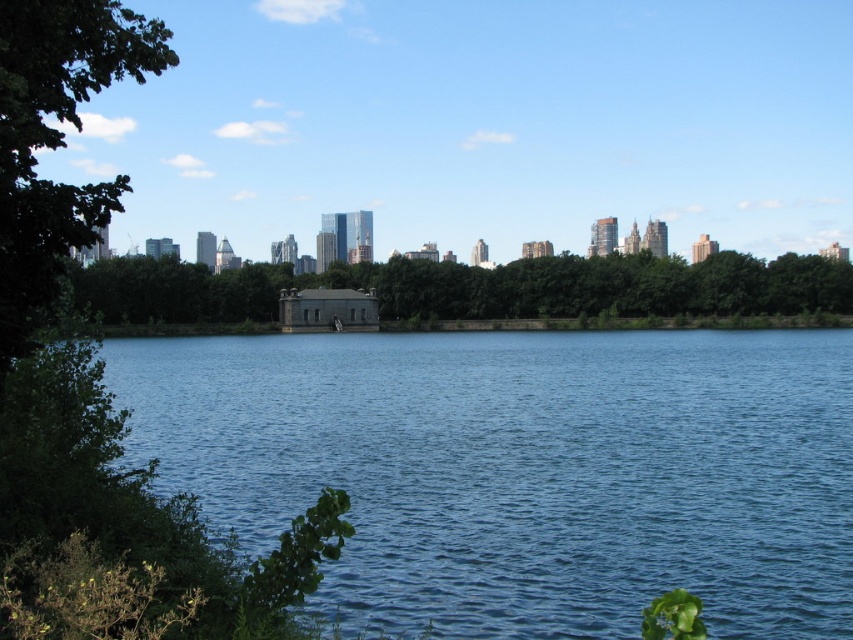
Between point (689, 586) and point (167, 61), which one is positioned in front?

Point (689, 586) is more forward.

Does blue water at center have a greater height compared to green leafy tree at left?

No.

Image resolution: width=853 pixels, height=640 pixels. Find the location of `blue water at center`. blue water at center is located at coordinates (521, 470).

Does green leafy trees at center appear on the left side of green leafy tree at left?

No, green leafy trees at center is not to the left of green leafy tree at left.

Is green leafy trees at center thinner than green leafy tree at left?

No.

Image resolution: width=853 pixels, height=640 pixels. I want to click on green leafy trees at center, so click(x=474, y=288).

Between blue water at center and green leafy trees at center, which one appears on the right side from the viewer's perspective?

green leafy trees at center is more to the right.

Does blue water at center have a larger size compared to green leafy trees at center?

Yes, blue water at center is bigger than green leafy trees at center.

Image resolution: width=853 pixels, height=640 pixels. I want to click on blue water at center, so click(x=521, y=470).